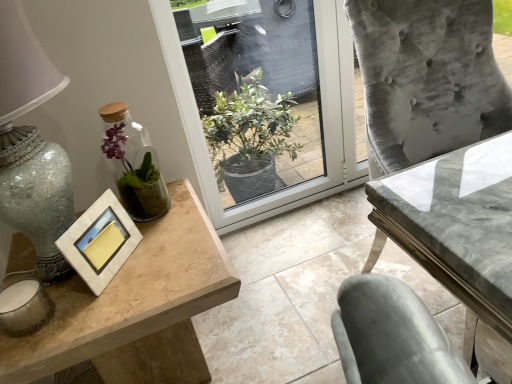
What are the coordinates of `free space in front of clear glass vase at left` in the screenshot? It's located at (161, 242).